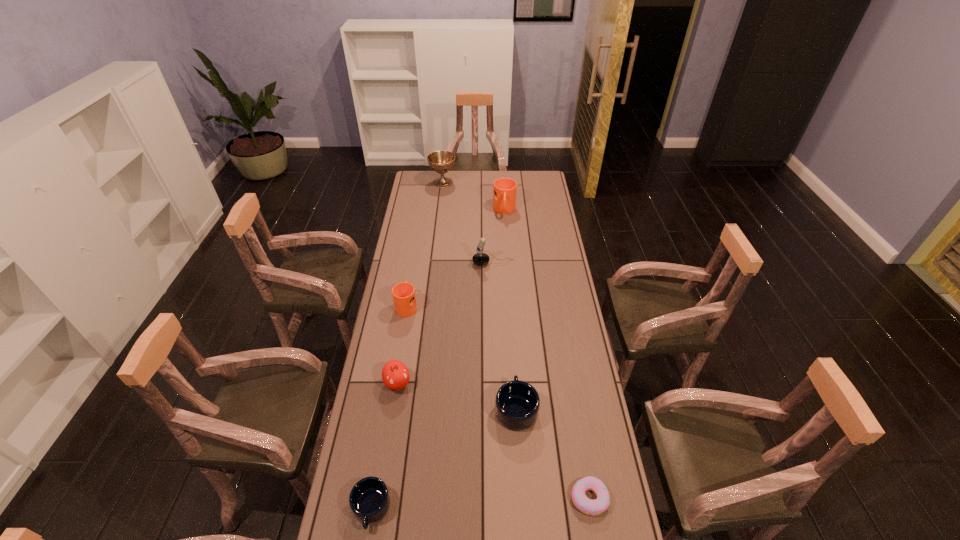
Where is `object that is at the far left corner`? This screenshot has height=540, width=960. object that is at the far left corner is located at coordinates (440, 161).

Where is `free region at the left edge of the desktop`? free region at the left edge of the desktop is located at coordinates (416, 284).

The width and height of the screenshot is (960, 540). What are the coordinates of `blank space at the right edge of the desktop` in the screenshot? It's located at (593, 476).

Image resolution: width=960 pixels, height=540 pixels. I want to click on blank space at the far right corner of the desktop, so click(529, 174).

Where is `empty space between the red apple and the third tallest mug`? This screenshot has width=960, height=540. empty space between the red apple and the third tallest mug is located at coordinates (457, 396).

In order to click on empty space that is in between the nearer blue mug and the red apple in this screenshot , I will do (384, 446).

Where is `vacant area that lies between the bigger blue mug and the second farthest mug`? The image size is (960, 540). vacant area that lies between the bigger blue mug and the second farthest mug is located at coordinates (462, 357).

You are a GUI agent. You are given a task and a screenshot of the screen. Output one action in this format:
    pyautogui.click(x=<x>, y=<y>)
    Task: Click on the vacant space that's between the farthest object and the white microphone
    The width and height of the screenshot is (960, 540).
    Given the screenshot: What is the action you would take?
    pyautogui.click(x=468, y=223)

I want to click on vacant point located between the farther blue mug and the farther orange mug, so click(x=511, y=309).

The image size is (960, 540). In order to click on empty space between the rightmost object and the bigger blue mug in this screenshot , I will do `click(553, 453)`.